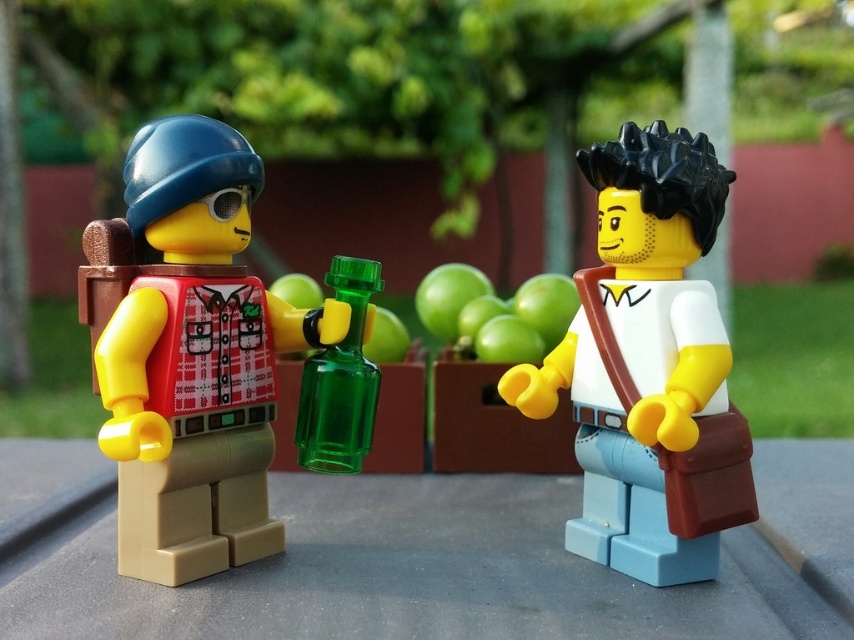
You are a guest at a dinner party and see the smooth gray table at center and the white matte shirt at center. Which object is closer to the floor?

The smooth gray table at center is closer to the floor because it is positioned below the white matte shirt at center.

From the picture: You are a guest at a party and see the smooth gray table at center and the green translucent bottle at center. Which object is closer to the floor?

The smooth gray table at center is closer to the floor because it is positioned below the green translucent bottle at center.

You are a small toy measuring 3 inches in width. You want to place yourself between the smooth gray table at center and the white matte shirt at center. Is there enough space for you to fit there?

The smooth gray table at center is 7.59 inches away from the white matte shirt at center. Since the distance between them is greater than your width of 3 inches, you can fit between them.